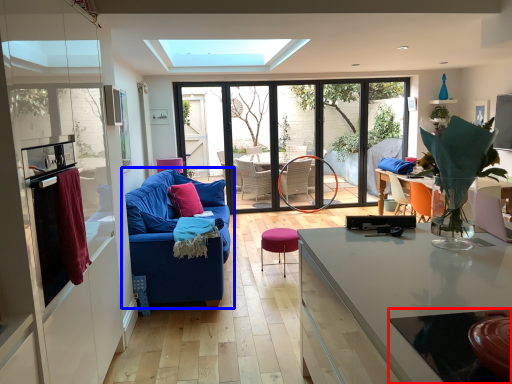
Question: Which of the following is the farthest to the observer, glass table (highlighted by a red box) or studio couch (highlighted by a blue box)?

Choices:
 (A) glass table
 (B) studio couch

Answer: (B)